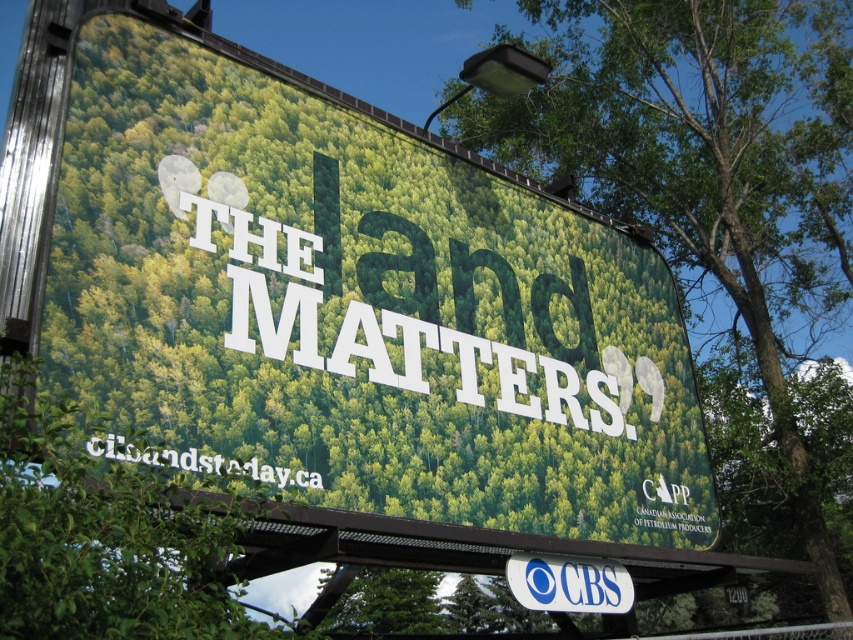
Question: Can you confirm if green leafy tree at lower left is positioned above blue plastic cbs sign at center?

Choices:
 (A) no
 (B) yes

Answer: (B)

Question: Which point is closer to the camera?

Choices:
 (A) green leafy tree at lower left
 (B) blue plastic cbs sign at center
 (C) green leafy tree at upper right

Answer: (A)

Question: Does green matte billboard at upper center have a lesser width compared to blue plastic cbs sign at center?

Choices:
 (A) no
 (B) yes

Answer: (A)

Question: Which point is farther from the camera taking this photo?

Choices:
 (A) (596, 17)
 (B) (114, 214)

Answer: (A)

Question: Based on their relative distances, which object is nearer to the green leafy tree at upper right?

Choices:
 (A) green matte billboard at upper center
 (B) blue plastic cbs sign at center

Answer: (A)

Question: Is green matte billboard at upper center positioned behind green leafy tree at upper right?

Choices:
 (A) yes
 (B) no

Answer: (B)